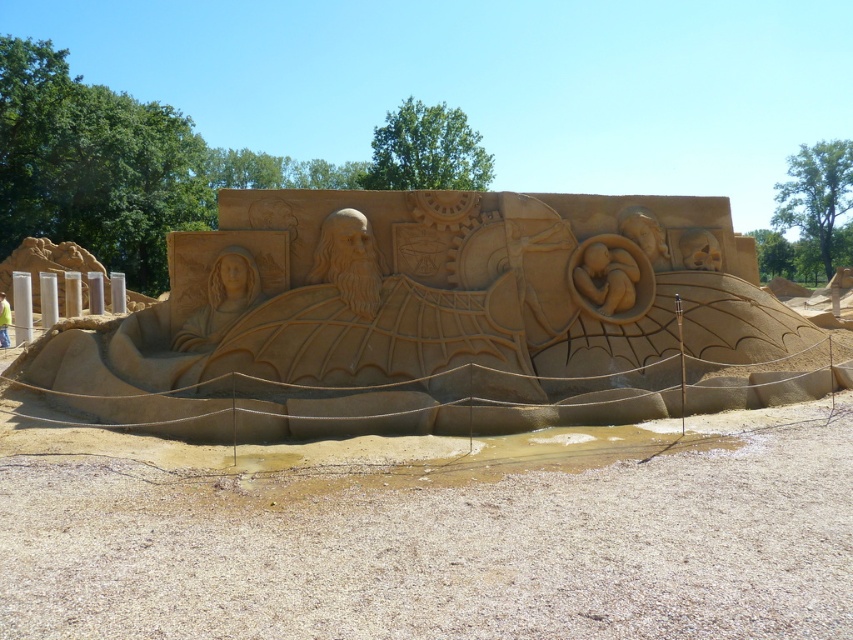
Question: Which object appears closest to the camera in this image?

Choices:
 (A) sandy sculpture at center
 (B) matte sand sculpture at center
 (C) fine-grained sand at center
 (D) smooth sand sculpture at center

Answer: (C)

Question: Considering the relative positions of fine-grained sand at center and sandy sculpture at center in the image provided, where is fine-grained sand at center located with respect to sandy sculpture at center?

Choices:
 (A) above
 (B) below

Answer: (B)

Question: Can you confirm if fine-grained sand at center is smaller than sandy sculpture at center?

Choices:
 (A) yes
 (B) no

Answer: (A)

Question: Which object is closer to the camera taking this photo?

Choices:
 (A) sandy sculpture at center
 (B) smooth sand sculpture at center
 (C) matte sand sculpture at center
 (D) fine-grained sand at center

Answer: (D)

Question: Does fine-grained sand at center appear on the right side of smooth sand sculpture at center?

Choices:
 (A) no
 (B) yes

Answer: (B)

Question: Which object is farther from the camera taking this photo?

Choices:
 (A) sandy sculpture at center
 (B) matte sand sculpture at center

Answer: (B)